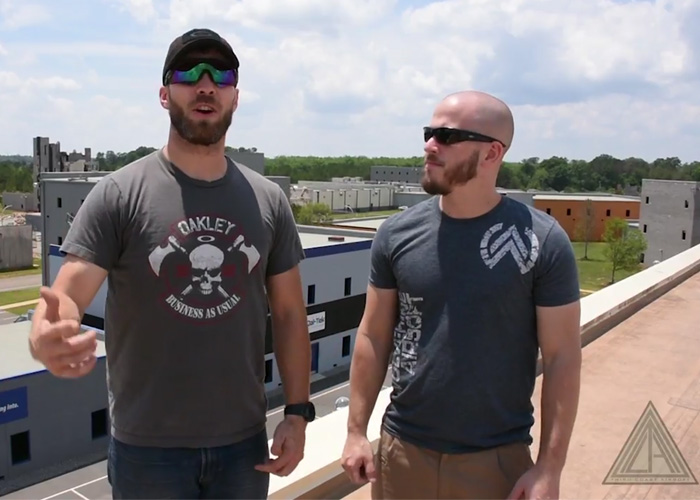
The image size is (700, 500). What are the coordinates of `doors` in the screenshot? It's located at (313, 363), (640, 257).